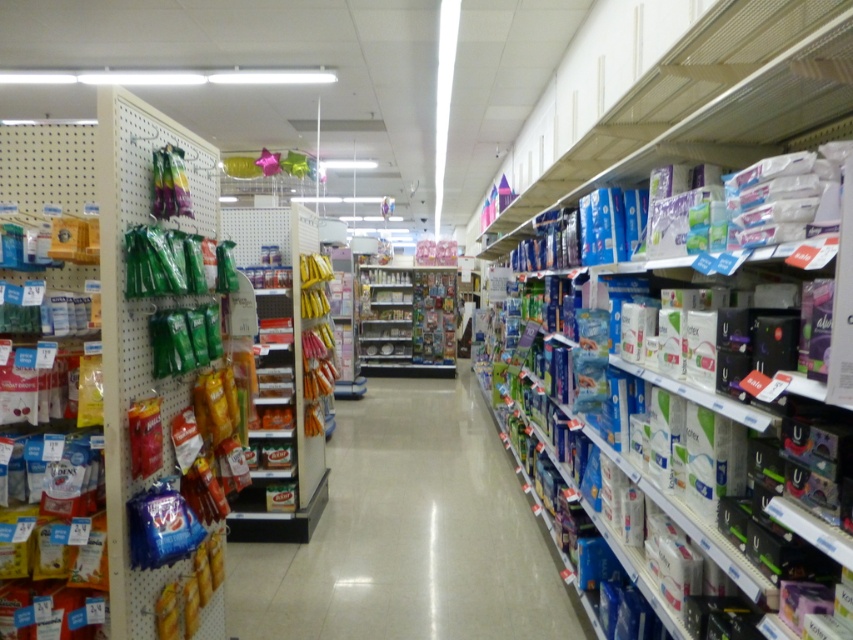
Which is more to the right, white matte sanitary pads at right or metallic silver shelves at center?

Positioned to the right is white matte sanitary pads at right.

Does white matte sanitary pads at right appear under metallic silver shelves at center?

No, white matte sanitary pads at right is not below metallic silver shelves at center.

Identify the location of white matte sanitary pads at right. (706, 104).

Is green matte snack packet at left to the right of metallic silver shelves at center from the viewer's perspective?

In fact, green matte snack packet at left is to the left of metallic silver shelves at center.

Between green matte snack packet at left and metallic silver shelves at center, which one appears on the right side from the viewer's perspective?

metallic silver shelves at center is more to the right.

Between point (91, 372) and point (367, 276), which one is positioned in front?

Point (91, 372) is in front.

You are a GUI agent. You are given a task and a screenshot of the screen. Output one action in this format:
    pyautogui.click(x=<x>, y=<y>)
    Task: Click on the green matte snack packet at left
    This screenshot has height=640, width=853.
    Given the screenshot: What is the action you would take?
    pyautogui.click(x=102, y=356)

Is point (123, 602) in front of point (341, 582)?

Yes, it is in front of point (341, 582).

Can you confirm if green matte snack packet at left is bigger than blue plastic shelf at center?

Indeed, green matte snack packet at left has a larger size compared to blue plastic shelf at center.

The image size is (853, 640). What do you see at coordinates (102, 356) in the screenshot?
I see `green matte snack packet at left` at bounding box center [102, 356].

The width and height of the screenshot is (853, 640). In order to click on green matte snack packet at left in this screenshot , I will do `click(102, 356)`.